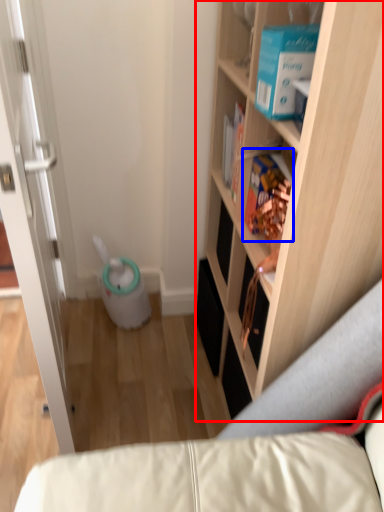
Question: Which of the following is the closest to the observer, cabinetry (highlighted by a red box) or book (highlighted by a blue box)?

Choices:
 (A) cabinetry
 (B) book

Answer: (A)